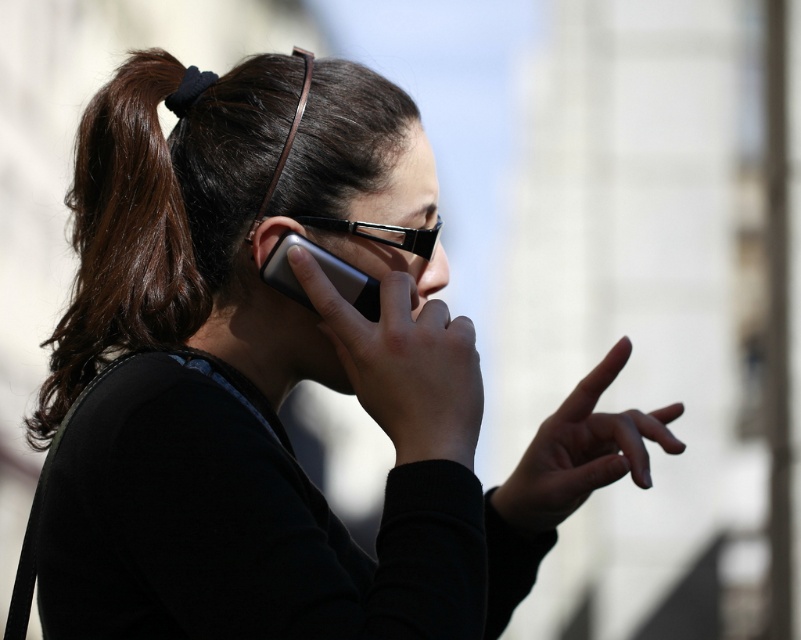
Who is shorter, silver metallic phone at center or black plastic glasses at center?

Standing shorter between the two is black plastic glasses at center.

Between silver metallic phone at center and black plastic glasses at center, which one appears on the right side from the viewer's perspective?

From the viewer's perspective, black plastic glasses at center appears more on the right side.

What do you see at coordinates (323, 273) in the screenshot?
I see `silver metallic phone at center` at bounding box center [323, 273].

Identify the location of silver metallic phone at center. This screenshot has height=640, width=801. (323, 273).

Consider the image. Is brown shiny hair at upper left to the left of matte black ear at center from the viewer's perspective?

Yes, brown shiny hair at upper left is to the left of matte black ear at center.

Can you confirm if brown shiny hair at upper left is shorter than matte black ear at center?

No.

Is point (135, 269) closer to viewer compared to point (296, 227)?

Yes, it is.

At what (x,y) coordinates should I click in order to perform the action: click on brown shiny hair at upper left. Please return your answer as a coordinate pair (x, y). Looking at the image, I should click on (123, 237).

Looking at this image, who is shorter, brown shiny hair at center or brown shiny hair at upper left?

With less height is brown shiny hair at upper left.

Who is positioned more to the left, brown shiny hair at center or brown shiny hair at upper left?

brown shiny hair at upper left

Where is `brown shiny hair at center`? This screenshot has width=801, height=640. brown shiny hair at center is located at coordinates (160, 209).